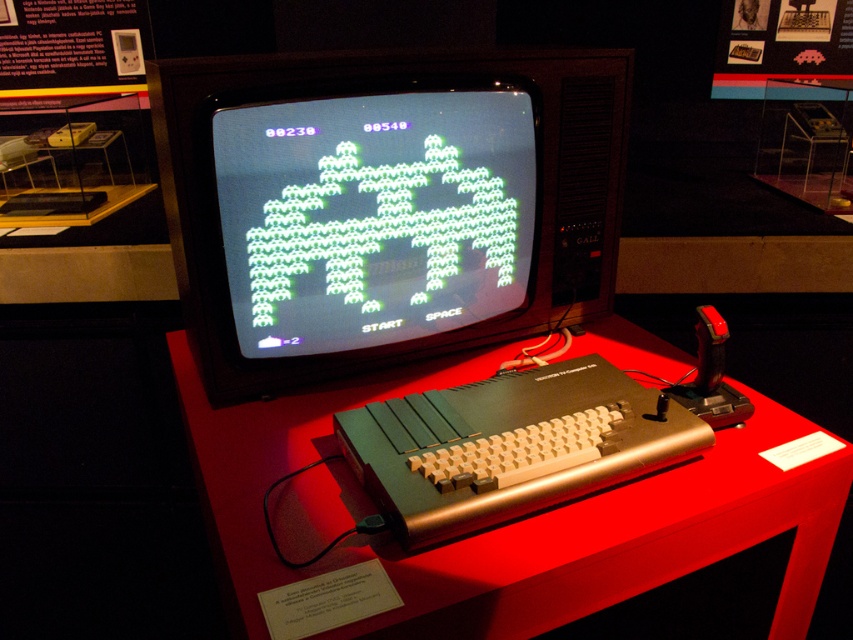
You are a museum curator planning to move the black plastic monitor at center and the metallic red table at center to a new exhibit. If you need to stack them vertically, which one should be placed at the bottom to ensure stability?

The metallic red table at center should be placed at the bottom because it is thicker than the black plastic monitor at center, providing a stable base for stacking.

You are a museum visitor holding a 20 cm long ruler. You want to measure the distance between the black plastic monitor at center and the camera. Can your ruler reach that distance?

The distance between the black plastic monitor at center and the camera is 87.90 centimeters. Since your ruler is only 20 cm long, it cannot reach the full distance of 87.90 centimeters. You would need a longer measuring tool.